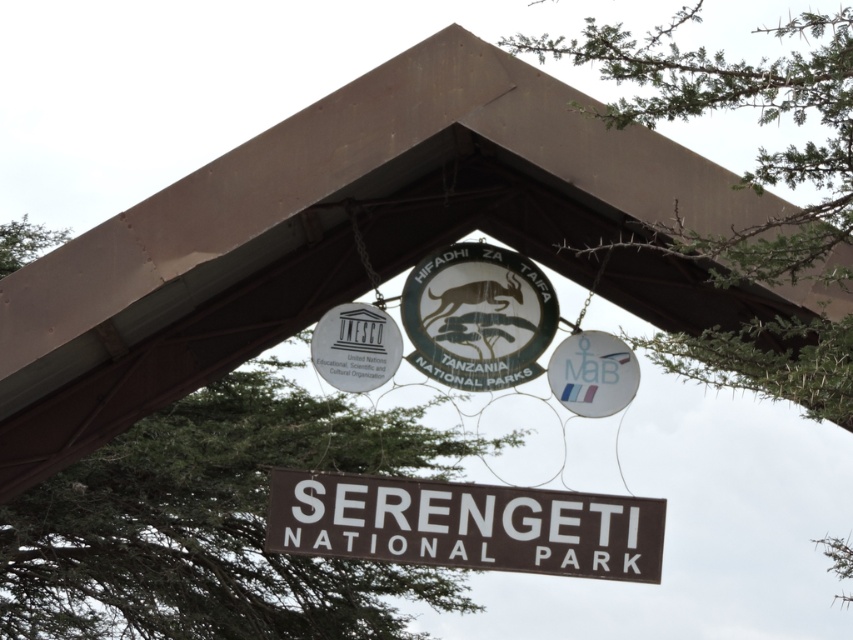
Question: Is green leafy tree at center to the left of green leafy tree at upper center from the viewer's perspective?

Choices:
 (A) yes
 (B) no

Answer: (A)

Question: Does green leafy tree at center appear on the right side of brown matte signboard at center?

Choices:
 (A) no
 (B) yes

Answer: (A)

Question: Which of these objects is positioned farthest from the green leafy tree at upper center?

Choices:
 (A) green matte/soft textured sign at center
 (B) green leafy tree at center

Answer: (B)

Question: Which of the following is the farthest from the observer?

Choices:
 (A) brown matte signboard at center
 (B) green leafy tree at center

Answer: (B)

Question: Estimate the real-world distances between objects in this image. Which object is closer to the green matte/soft textured sign at center?

Choices:
 (A) green leafy tree at center
 (B) brown matte signboard at center
 (C) green leafy tree at upper center

Answer: (B)

Question: Is green leafy tree at upper center thinner than green matte/soft textured sign at center?

Choices:
 (A) no
 (B) yes

Answer: (A)